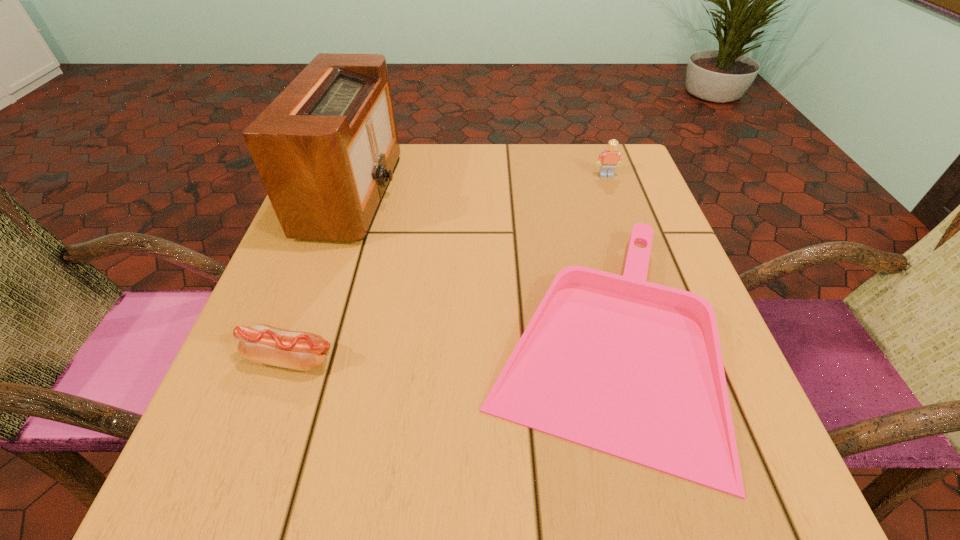
I want to click on vacant space that satisfies the following two spatial constraints: 1. on the front-facing side of the third shortest object; 2. on the handle side of the shortest object, so click(x=663, y=339).

Locate an element on the screen. The height and width of the screenshot is (540, 960). vacant area that satisfies the following two spatial constraints: 1. on the front-facing side of the second tallest object; 2. on the handle side of the shortest object is located at coordinates (663, 339).

In order to click on free space in the image that satisfies the following two spatial constraints: 1. on the back side of the second shortest object; 2. on the left side of the radio receiver in this screenshot , I will do `click(349, 193)`.